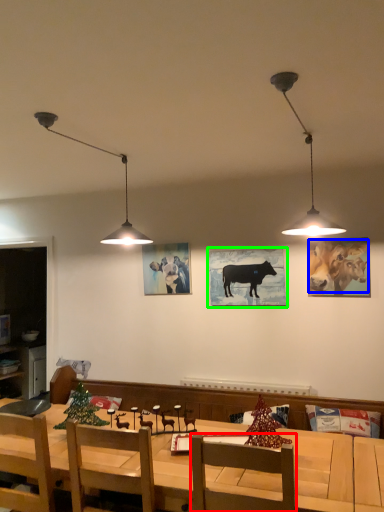
Question: Which is nearer to the chair (highlighted by a red box)? cattle (highlighted by a blue box) or picture frame (highlighted by a green box).

Choices:
 (A) cattle
 (B) picture frame

Answer: (B)